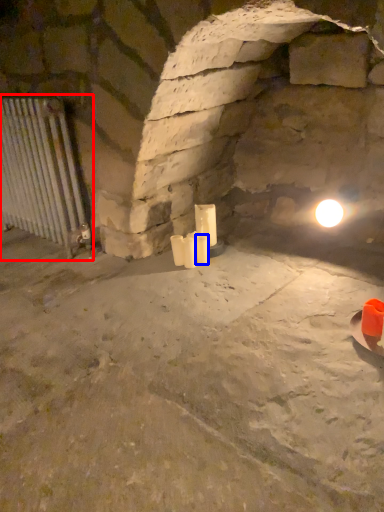
Question: Which object is closer to the camera taking this photo, cage (highlighted by a red box) or candle (highlighted by a blue box)?

Choices:
 (A) cage
 (B) candle

Answer: (A)